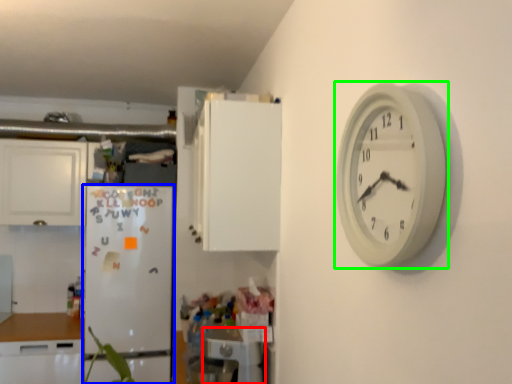
Question: Which is nearer to the appliance (highlighted by a red box)? fridge (highlighted by a blue box) or wall clock (highlighted by a green box).

Choices:
 (A) fridge
 (B) wall clock

Answer: (A)